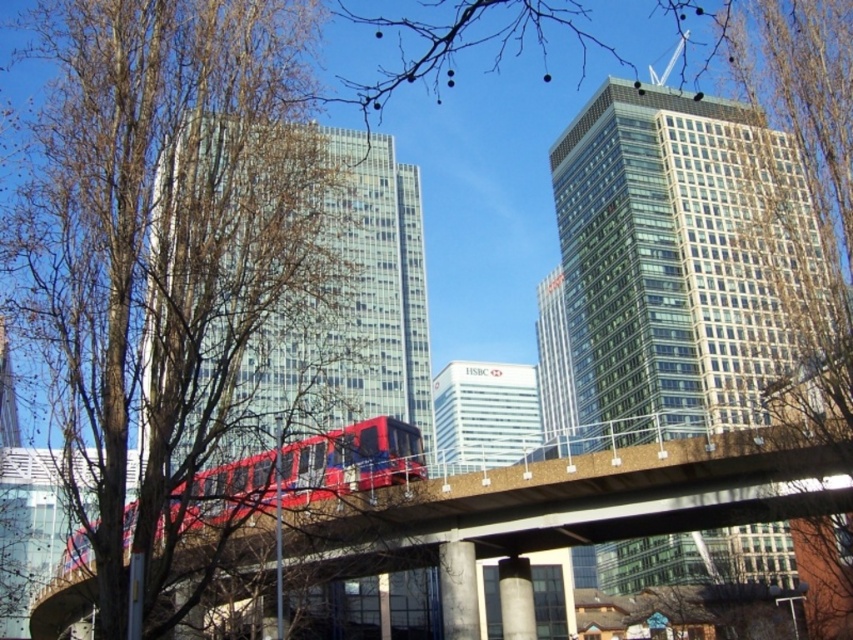
Who is lower down, brown leafless tree at left or metallic red train at center?

metallic red train at center is below.

Between brown leafless tree at left and metallic red train at center, which one appears on the left side from the viewer's perspective?

brown leafless tree at left

Locate an element on the screen. The width and height of the screenshot is (853, 640). brown leafless tree at left is located at coordinates (165, 241).

You are a GUI agent. You are given a task and a screenshot of the screen. Output one action in this format:
    pyautogui.click(x=<x>, y=<y>)
    Task: Click on the brown leafless tree at left
    
    Given the screenshot: What is the action you would take?
    pyautogui.click(x=165, y=241)

Can you confirm if brown leafless tree at left is bigger than metal/concrete bridge at center?

Yes, brown leafless tree at left is bigger than metal/concrete bridge at center.

Does brown leafless tree at left have a greater width compared to metal/concrete bridge at center?

No, brown leafless tree at left is not wider than metal/concrete bridge at center.

Where is `brown leafless tree at left`? brown leafless tree at left is located at coordinates (165, 241).

Where is `brown leafless tree at left`? The height and width of the screenshot is (640, 853). brown leafless tree at left is located at coordinates (165, 241).

Between point (566, 513) and point (250, 472), which one is positioned in front?

Point (566, 513) is more forward.

Is metal/concrete bridge at center above metallic red train at center?

Incorrect, metal/concrete bridge at center is not positioned above metallic red train at center.

Where is `metal/concrete bridge at center`? metal/concrete bridge at center is located at coordinates (570, 500).